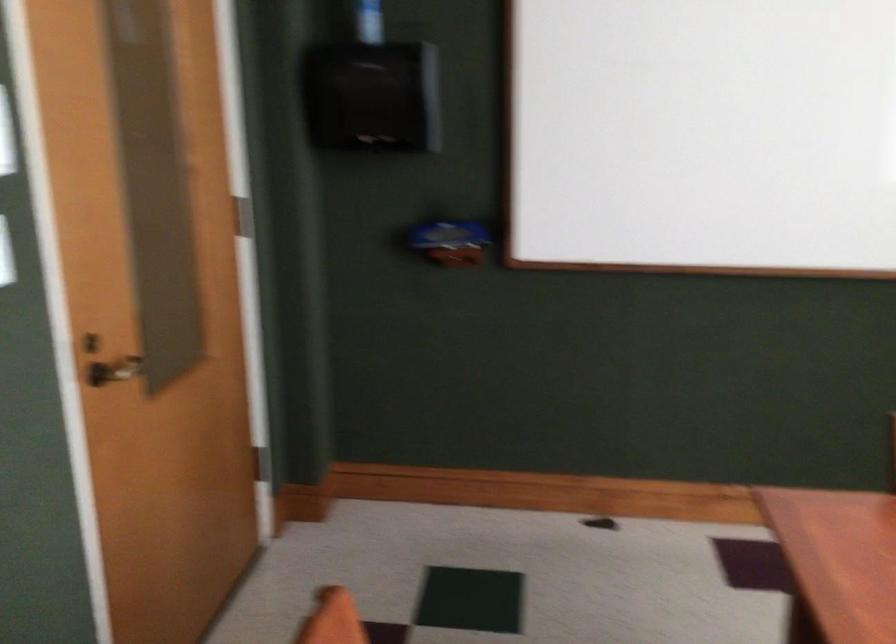
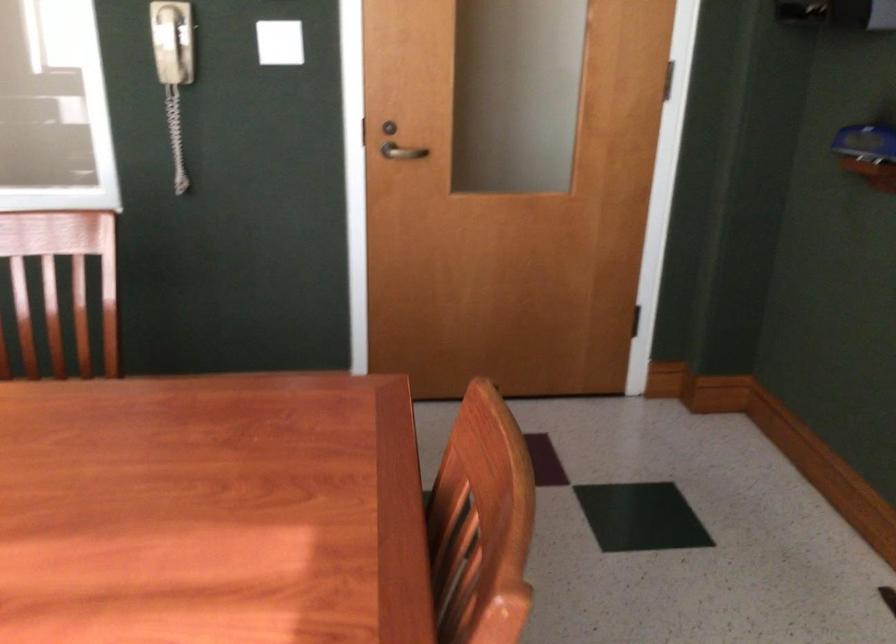
In the second image, find the point that corresponds to point (126, 380) in the first image.

(401, 152)